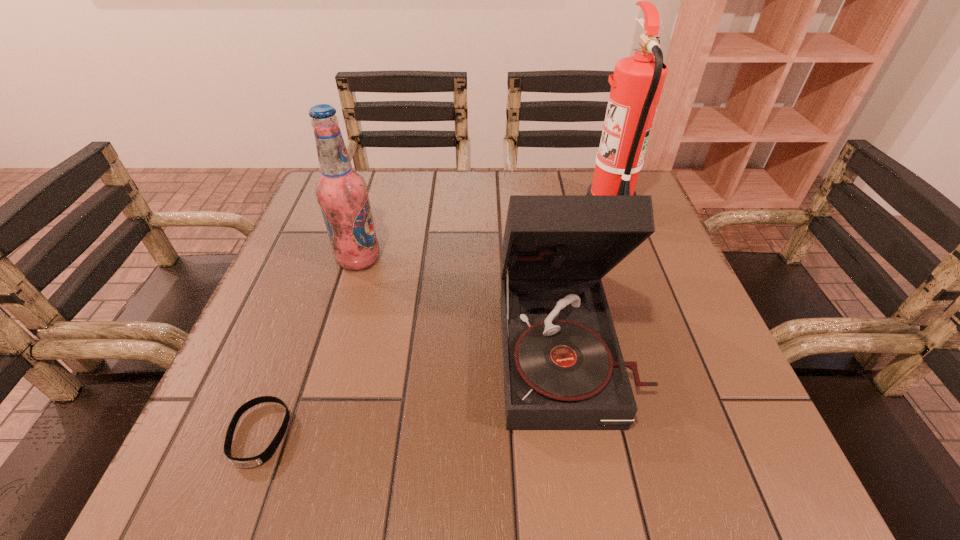
I want to click on phonograph_record at the near edge, so click(x=563, y=367).

Locate an element on the screen. The image size is (960, 540). wristband that is at the near edge is located at coordinates (260, 459).

The image size is (960, 540). In order to click on alcohol at the left edge in this screenshot , I will do coord(342,193).

I want to click on wristband that is at the left edge, so click(x=260, y=459).

This screenshot has height=540, width=960. In order to click on fire extinguisher at the right edge in this screenshot , I will do `click(636, 86)`.

At what (x,y) coordinates should I click in order to perform the action: click on phonograph_record that is at the right edge. Please return your answer as a coordinate pair (x, y). The width and height of the screenshot is (960, 540). Looking at the image, I should click on (563, 367).

Locate an element on the screen. This screenshot has width=960, height=540. object present at the near left corner is located at coordinates (260, 459).

Locate an element on the screen. Image resolution: width=960 pixels, height=540 pixels. object at the far right corner is located at coordinates (636, 86).

In order to click on object at the near right corner in this screenshot , I will do `click(563, 367)`.

Where is `vacant space at the far edge`? vacant space at the far edge is located at coordinates (437, 191).